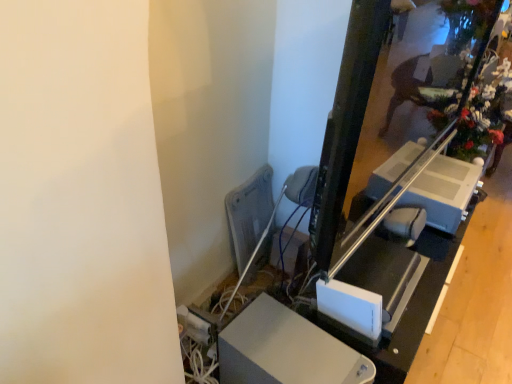
This screenshot has width=512, height=384. What do you see at coordinates (249, 213) in the screenshot? I see `gray metallic radiator at center` at bounding box center [249, 213].

Where is `white plastic table at center`? white plastic table at center is located at coordinates (409, 300).

From a real-world perspective, between white plastic lift at right and gray metallic radiator at center, who is vertically lower?

In real-world perspective, gray metallic radiator at center is lower.

I want to click on lift above the gray metallic radiator at center (from a real-world perspective), so pyautogui.click(x=443, y=191).

Could you tell me if white plastic lift at right is turned towards gray metallic radiator at center?

No, white plastic lift at right is not oriented towards gray metallic radiator at center.

Considering the relative sizes of white plastic lift at right and gray metallic radiator at center in the image provided, is white plastic lift at right thinner than gray metallic radiator at center?

No.

Between white plastic table at center and white plastic lift at right, which one has larger size?

white plastic table at center is bigger.

Is white plastic table at center not within white plastic lift at right?

Yes, white plastic table at center is outside of white plastic lift at right.

Is white plastic table at center oriented away from white plastic lift at right?

No, white plastic table at center is not facing away from white plastic lift at right.

Can you confirm if white plastic table at center is positioned to the left of white plastic lift at right?

Indeed, white plastic table at center is positioned on the left side of white plastic lift at right.

Between white plastic speaker at center and white plastic table at center, which one has larger size?

With larger size is white plastic table at center.

From the image's perspective, is white plastic speaker at center above or below white plastic table at center?

Based on their image positions, white plastic speaker at center is located beneath white plastic table at center.

Identify the location of table above the white plastic speaker at center (from the image's perspective). (409, 300).

Can you tell me how much white plastic speaker at center and white plastic table at center differ in facing direction?

There is a 5.43-degree angle between the facing directions of white plastic speaker at center and white plastic table at center.

Consider the image. Is white plastic lift at right taller than white plastic speaker at center?

No, white plastic lift at right is not taller than white plastic speaker at center.

Consider the image. Would you consider white plastic lift at right to be distant from white plastic speaker at center?

That's not correct — white plastic lift at right is a little close to white plastic speaker at center.

Is gray metallic radiator at center at the back of white plastic table at center?

Yes, white plastic table at center's orientation is away from gray metallic radiator at center.

Considering the relative positions of white plastic table at center and gray metallic radiator at center in the image provided, is white plastic table at center to the left or to the right of gray metallic radiator at center?

Clearly, white plastic table at center is on the right of gray metallic radiator at center in the image.

In the scene shown: From the image's perspective, is white plastic table at center located above gray metallic radiator at center?

No, from the image's perspective, white plastic table at center is not over gray metallic radiator at center.

Between point (417, 241) and point (258, 186), which one is positioned in front?

Point (417, 241)

Where is `furniture that appears in front of the white plastic lift at right`? furniture that appears in front of the white plastic lift at right is located at coordinates (285, 350).

From the image's perspective, between white plastic speaker at center and white plastic lift at right, which one is located above?

white plastic lift at right appears higher in the image.

Is white plastic speaker at center aimed at white plastic lift at right?

No, white plastic speaker at center is not aimed at white plastic lift at right.

Is white plastic speaker at center completely or partially outside of white plastic lift at right?

Indeed, white plastic speaker at center is completely outside white plastic lift at right.

Does white plastic speaker at center touch gray metallic radiator at center?

No, white plastic speaker at center is not touching gray metallic radiator at center.

Does white plastic speaker at center appear on the left side of gray metallic radiator at center?

In fact, white plastic speaker at center is to the right of gray metallic radiator at center.

Consider the image. Who is more distant, white plastic speaker at center or gray metallic radiator at center?

Positioned behind is gray metallic radiator at center.

How different are the orientations of white plastic speaker at center and gray metallic radiator at center in degrees?

white plastic speaker at center and gray metallic radiator at center are facing 1.2 degrees away from each other.

This screenshot has width=512, height=384. Find the location of `lift above the gray metallic radiator at center (from the image's perspective)`. lift above the gray metallic radiator at center (from the image's perspective) is located at coordinates (443, 191).

Image resolution: width=512 pixels, height=384 pixels. What are the coordinates of `lift on the right of white plastic table at center` in the screenshot? It's located at (443, 191).

Based on their spatial positions, is white plastic table at center or gray metallic radiator at center closer to white plastic lift at right?

white plastic table at center.

Considering their positions, is white plastic table at center positioned closer to gray metallic radiator at center than white plastic speaker at center?

The object closer to gray metallic radiator at center is white plastic table at center.

Consider the image. When comparing their distances from white plastic speaker at center, does white plastic table at center or gray metallic radiator at center seem further?

Based on the image, gray metallic radiator at center appears to be further to white plastic speaker at center.

When comparing their distances from white plastic table at center, does gray metallic radiator at center or white plastic lift at right seem closer?

white plastic lift at right lies closer to white plastic table at center than the other object.

Looking at this image, based on their spatial positions, is white plastic speaker at center or gray metallic radiator at center closer to white plastic lift at right?

Based on the image, gray metallic radiator at center appears to be nearer to white plastic lift at right.

From the image, which object appears to be farther from white plastic lift at right, gray metallic radiator at center or white plastic speaker at center?

white plastic speaker at center.

Based on their spatial positions, is white plastic table at center or white plastic lift at right closer to white plastic speaker at center?

Among the two, white plastic table at center is located nearer to white plastic speaker at center.

Considering their positions, is white plastic lift at right positioned closer to white plastic table at center than gray metallic radiator at center?

The object closer to white plastic table at center is white plastic lift at right.

Find the location of `table located between white plastic speaker at center and white plastic lift at right in the left-right direction`. table located between white plastic speaker at center and white plastic lift at right in the left-right direction is located at coordinates tap(409, 300).

Locate an element on the screen. The image size is (512, 384). table between gray metallic radiator at center and white plastic lift at right in the horizontal direction is located at coordinates (409, 300).

Identify the location of furniture between gray metallic radiator at center and white plastic table at center from left to right. (285, 350).

Where is `furniture located between gray metallic radiator at center and white plastic lift at right in the left-right direction`? furniture located between gray metallic radiator at center and white plastic lift at right in the left-right direction is located at coordinates (285, 350).